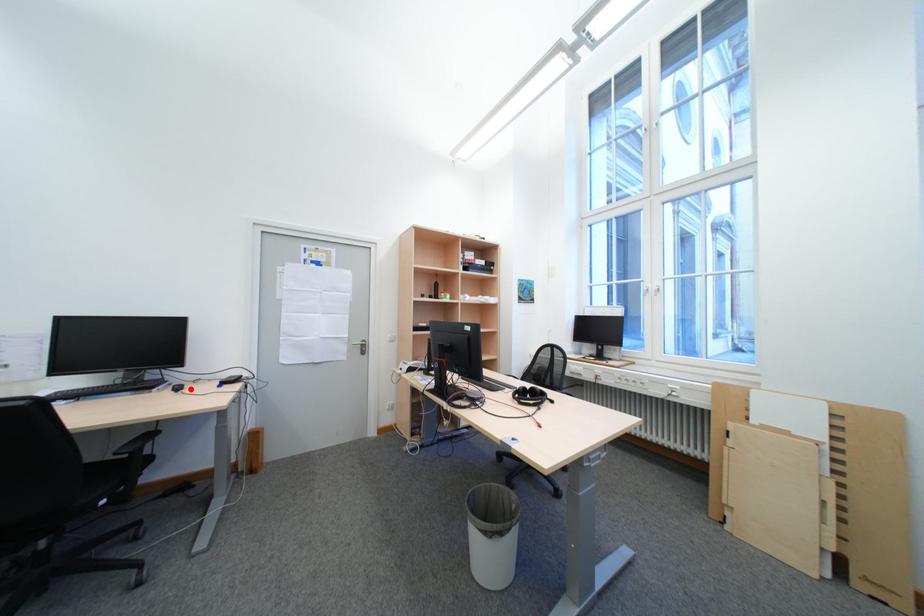
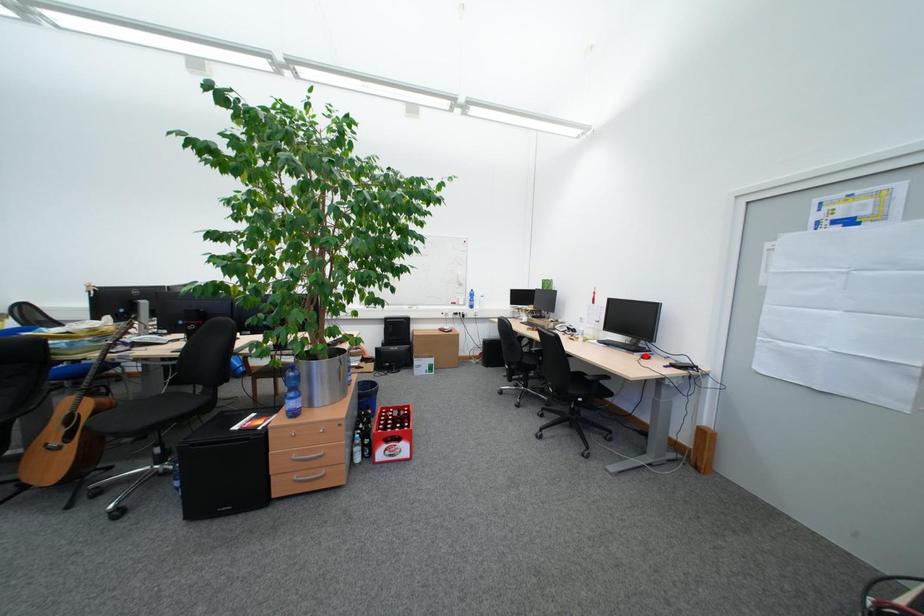
I am providing you with two images of the same scene from different viewpoints. A red point is marked on the first image and another point is marked on the second image. Are the points marked in image1 and image2 representing the same 3D position?

No